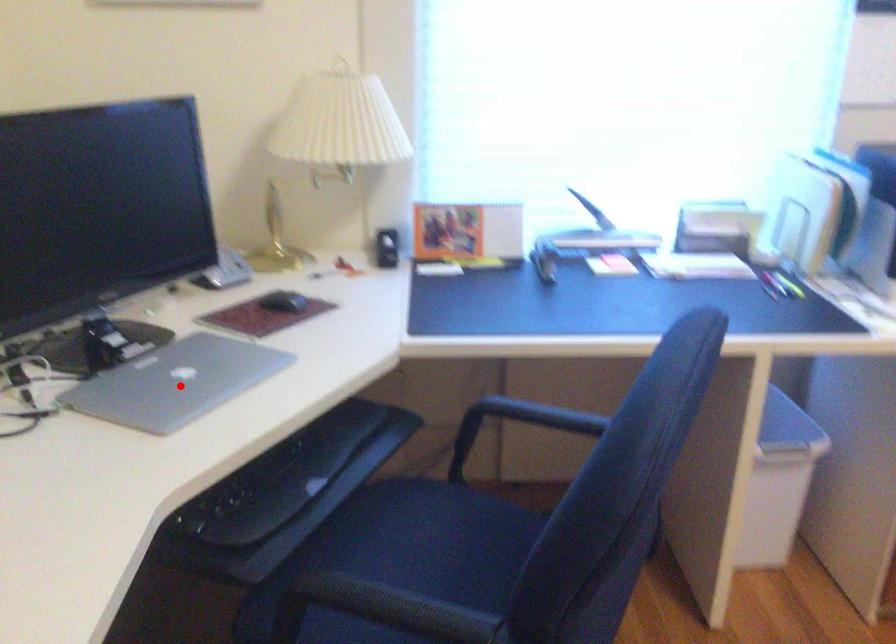
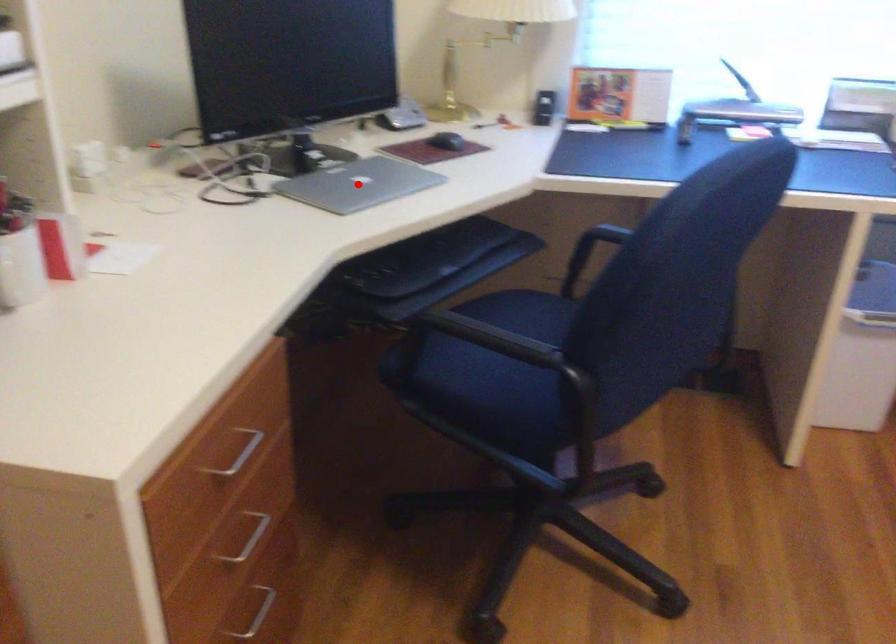
I am providing you with two images of the same scene from different viewpoints. A red point is marked on the first image and another point is marked on the second image. Is the red point in image1 aligned with the point shown in image2?

Yes